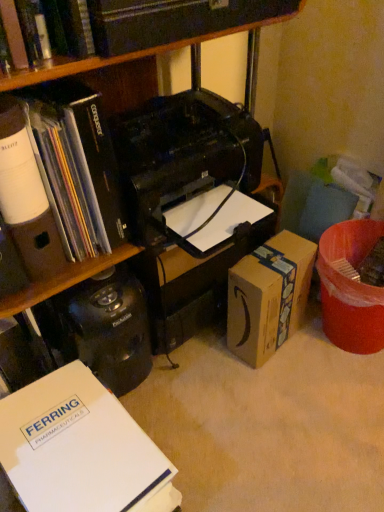
This screenshot has height=512, width=384. In order to click on free space above white paper at lower left, the 1th book positioned from the bottom (from a real-world perspective) in this screenshot , I will do `click(41, 428)`.